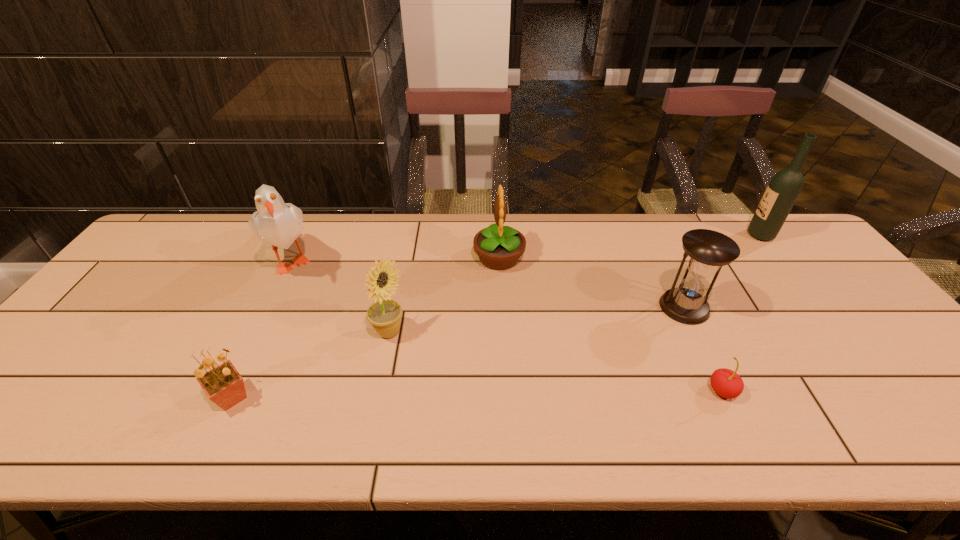
The image size is (960, 540). I want to click on free space located on the labeled side of the rightmost object, so click(688, 235).

Where is `vacant region located 0.170m on the labeled side of the rightmost object`? This screenshot has width=960, height=540. vacant region located 0.170m on the labeled side of the rightmost object is located at coordinates (695, 235).

Image resolution: width=960 pixels, height=540 pixels. Find the location of `free spot located 0.070m on the labeled side of the rightmost object`. free spot located 0.070m on the labeled side of the rightmost object is located at coordinates (726, 235).

Locate an element on the screen. This screenshot has width=960, height=540. vacant area situated 0.280m at the beak of the gull is located at coordinates (233, 381).

The image size is (960, 540). In order to click on vacant space located 0.080m on the face of the fourth object from left to right in this screenshot , I will do `click(447, 258)`.

At what (x,y) coordinates should I click in order to perform the action: click on free space located on the face of the fourth object from left to right. Please return your answer as a coordinate pair (x, y). Looking at the image, I should click on (424, 258).

I want to click on free location located 0.160m on the face of the fourth object from left to right, so click(x=420, y=258).

The image size is (960, 540). I want to click on free point located 0.380m on the face of the fifth object from right to left, so 557,333.

Identify the location of vacant area situated 0.330m on the right of the hourglass. (831, 307).

At what (x,y) coordinates should I click in order to perform the action: click on vacant position located at the front of the second shortest object with flowers visible. Please return your answer as a coordinate pair (x, y). The width and height of the screenshot is (960, 540). Looking at the image, I should click on (317, 398).